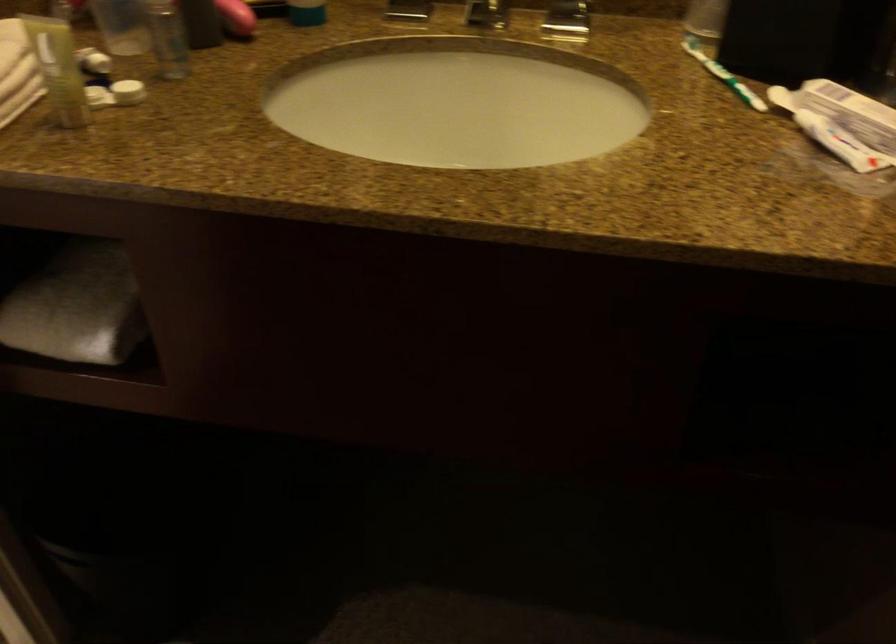
Find where to lift the white container lid. Please return your answer as a coordinate pair (x, y).

(457, 102)